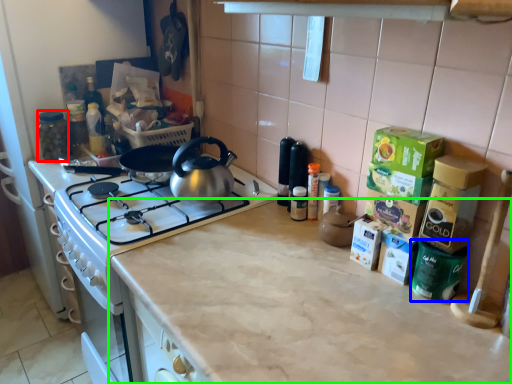
Question: Based on their relative distances, which object is farther from appliance (highlighted by a red box)? Choose from appliance (highlighted by a blue box) and countertop (highlighted by a green box).

Choices:
 (A) appliance
 (B) countertop

Answer: (A)